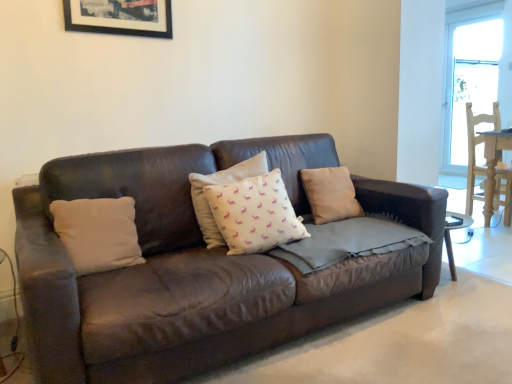
Question: Should I look upward or downward to see beige fabric pillow at center, positioned as the 4th pillow in left-to-right order?

Choices:
 (A) down
 (B) up

Answer: (A)

Question: From the image's perspective, would you say brown leather couch at center is shown under beige fabric pillow at center, the first pillow when ordered from right to left?

Choices:
 (A) no
 (B) yes

Answer: (B)

Question: Is brown leather couch at center to the right of beige fabric pillow at center, positioned as the 4th pillow in left-to-right order, from the viewer's perspective?

Choices:
 (A) yes
 (B) no

Answer: (B)

Question: Is brown leather couch at center at the left side of beige fabric pillow at center, the first pillow when ordered from right to left?

Choices:
 (A) no
 (B) yes

Answer: (B)

Question: Considering the relative sizes of brown leather couch at center and beige fabric pillow at center, the first pillow when ordered from right to left, in the image provided, is brown leather couch at center taller than beige fabric pillow at center, the first pillow when ordered from right to left,?

Choices:
 (A) yes
 (B) no

Answer: (B)

Question: Does brown leather couch at center have a greater width compared to beige fabric pillow at center, positioned as the 4th pillow in left-to-right order?

Choices:
 (A) yes
 (B) no

Answer: (A)

Question: Is beige fabric pillow at center, the first pillow when ordered from right to left, completely or partially inside brown leather couch at center?

Choices:
 (A) no
 (B) yes

Answer: (A)

Question: Is white fabric pillow with pink patterns at center, which is the second pillow in right-to-left order, not near beige fabric pillow at center, positioned as the 4th pillow in left-to-right order?

Choices:
 (A) no
 (B) yes

Answer: (A)

Question: Is beige fabric pillow at center, positioned as the 4th pillow in left-to-right order, at the back of white fabric pillow with pink patterns at center, which is the third pillow from left to right?

Choices:
 (A) yes
 (B) no

Answer: (B)

Question: Is white fabric pillow with pink patterns at center, which is the second pillow in right-to-left order, closer to camera compared to beige fabric pillow at center, the first pillow when ordered from right to left?

Choices:
 (A) no
 (B) yes

Answer: (B)

Question: Is white fabric pillow with pink patterns at center, which is the second pillow in right-to-left order, to the right of beige fabric pillow at center, positioned as the 4th pillow in left-to-right order, from the viewer's perspective?

Choices:
 (A) yes
 (B) no

Answer: (B)

Question: Is white fabric pillow with pink patterns at center, which is the second pillow in right-to-left order, positioned beyond the bounds of beige fabric pillow at center, the first pillow when ordered from right to left?

Choices:
 (A) yes
 (B) no

Answer: (A)

Question: Considering the relative sizes of white fabric pillow with pink patterns at center, which is the second pillow in right-to-left order, and beige fabric pillow at center, the first pillow when ordered from right to left, in the image provided, is white fabric pillow with pink patterns at center, which is the second pillow in right-to-left order, taller than beige fabric pillow at center, the first pillow when ordered from right to left,?

Choices:
 (A) yes
 (B) no

Answer: (A)

Question: Is black matte picture frame at upper center outside of white cotton cushion at center, which ranks as the 2th pillow in left-to-right order?

Choices:
 (A) no
 (B) yes

Answer: (B)